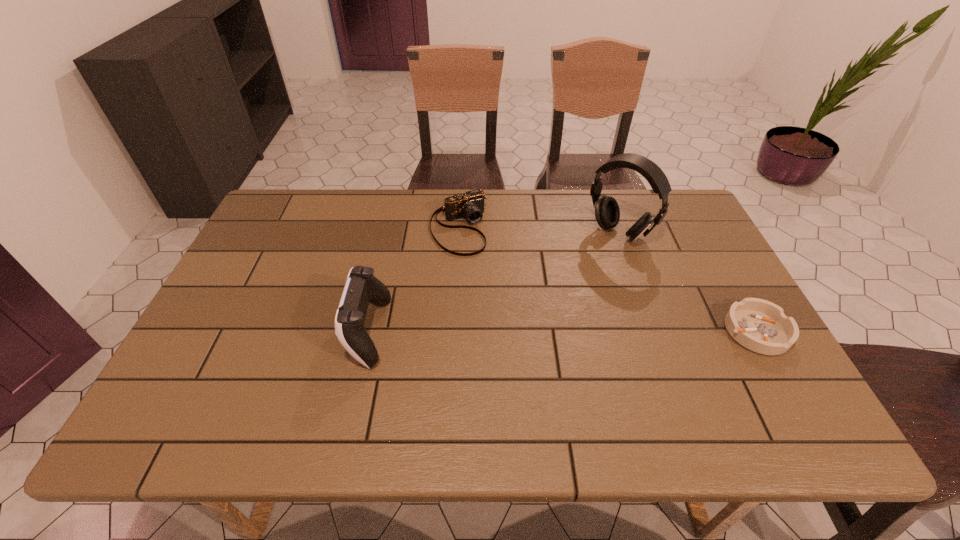
Identify the location of the leftmost object. The width and height of the screenshot is (960, 540). (362, 287).

Identify the location of control. (362, 287).

You are a GUI agent. You are given a task and a screenshot of the screen. Output one action in this format:
    pyautogui.click(x=<x>, y=<y>)
    Task: Click on the rightmost object
    
    Given the screenshot: What is the action you would take?
    pyautogui.click(x=761, y=326)

Where is `the shortest object`? The image size is (960, 540). the shortest object is located at coordinates (761, 326).

Where is `earphone`? The width and height of the screenshot is (960, 540). earphone is located at coordinates (607, 213).

The image size is (960, 540). In order to click on the third object from left to right in this screenshot , I will do `click(607, 213)`.

I want to click on the second shortest object, so click(x=470, y=205).

The height and width of the screenshot is (540, 960). In order to click on the third object from right to left in this screenshot , I will do `click(470, 205)`.

You are a GUI agent. You are given a task and a screenshot of the screen. Output one action in this format:
    pyautogui.click(x=<x>, y=<y>)
    Task: Click on the vacant space located on the front-facing side of the leftmost object
    
    Given the screenshot: What is the action you would take?
    pyautogui.click(x=267, y=332)

Locate an element on the screen. This screenshot has height=540, width=960. free spot located 0.100m on the front-facing side of the leftmost object is located at coordinates (308, 332).